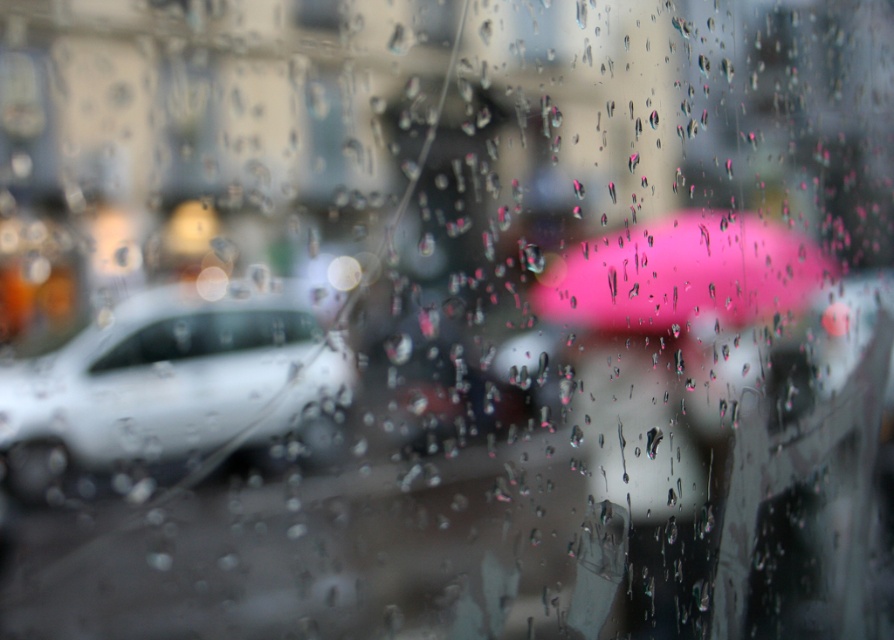
You are a delivery person needing to reach the pink matte umbrella at center from the white matte car at left. The path between them is clear, but you have a 30 cm wide box to carry. Can you pass through the space between them safely?

The white matte car at left is 25.05 centimeters away from the pink matte umbrella at center. Since the distance between them is less than the width of the box, you cannot pass through safely.

From the picture: You are standing in a room with the window described. You see the pink matte umbrella at center. If you want to touch it without moving your feet, can you reach it?

The pink matte umbrella at center is 19.66 inches away from viewer. Since the average human arm length is about 25 inches, you can likely reach it without moving your feet.

You are looking through a rainy window and notice two points marked on the glass. One is at coordinates point (x=239, y=380) and the other at point (x=807, y=259). Which point is closer to you based on their positions?

Point (x=239, y=380) is in front of point (x=807, y=259), so it is closer to you.